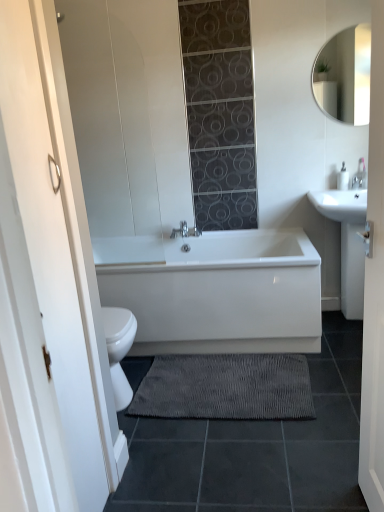
Question: Can you confirm if white glossy sink at right is thinner than white wooden door at center?

Choices:
 (A) yes
 (B) no

Answer: (B)

Question: From the image's perspective, is white glossy sink at right located above white wooden door at center?

Choices:
 (A) yes
 (B) no

Answer: (A)

Question: Considering the relative positions of white glossy sink at right and white wooden door at center in the image provided, is white glossy sink at right to the right of white wooden door at center from the viewer's perspective?

Choices:
 (A) yes
 (B) no

Answer: (A)

Question: Is white wooden door at center at the back of white glossy sink at right?

Choices:
 (A) yes
 (B) no

Answer: (B)

Question: Could you tell me if white glossy sink at right is turned towards white wooden door at center?

Choices:
 (A) no
 (B) yes

Answer: (B)

Question: From a real-world perspective, is white glossy sink at right under white wooden door at center?

Choices:
 (A) yes
 (B) no

Answer: (A)

Question: Does white wooden door at center have a larger size compared to white glossy bathtub at center?

Choices:
 (A) no
 (B) yes

Answer: (A)

Question: Would you consider white wooden door at center to be distant from white glossy bathtub at center?

Choices:
 (A) no
 (B) yes

Answer: (B)

Question: Does white wooden door at center have a greater height compared to white glossy bathtub at center?

Choices:
 (A) yes
 (B) no

Answer: (A)

Question: Considering the relative positions of white wooden door at center and white glossy bathtub at center in the image provided, is white wooden door at center to the left of white glossy bathtub at center from the viewer's perspective?

Choices:
 (A) no
 (B) yes

Answer: (A)

Question: Can you confirm if white wooden door at center is wider than white glossy bathtub at center?

Choices:
 (A) no
 (B) yes

Answer: (A)

Question: From a real-world perspective, is white wooden door at center beneath white glossy bathtub at center?

Choices:
 (A) no
 (B) yes

Answer: (A)

Question: Considering the relative sizes of white glossy mirror at upper right and white wooden door at center in the image provided, is white glossy mirror at upper right shorter than white wooden door at center?

Choices:
 (A) yes
 (B) no

Answer: (A)